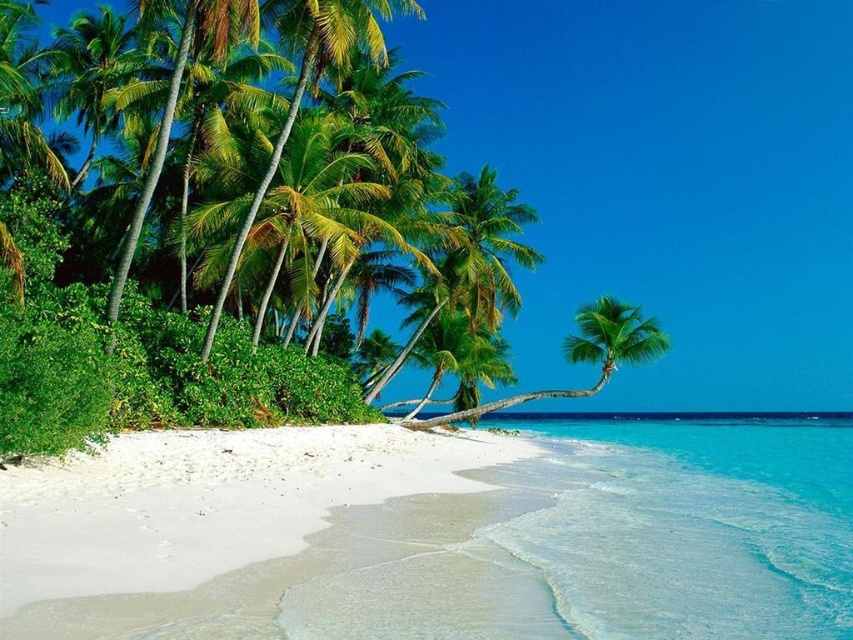
This screenshot has width=853, height=640. What do you see at coordinates (202, 518) in the screenshot? I see `white sandy beach at lower left` at bounding box center [202, 518].

Between white sandy beach at lower left and green leafy palm tree at center, which one has less height?

Standing shorter between the two is white sandy beach at lower left.

Does point (158, 586) lie behind point (602, 321)?

That is False.

Image resolution: width=853 pixels, height=640 pixels. What are the coordinates of `white sandy beach at lower left` in the screenshot? It's located at (202, 518).